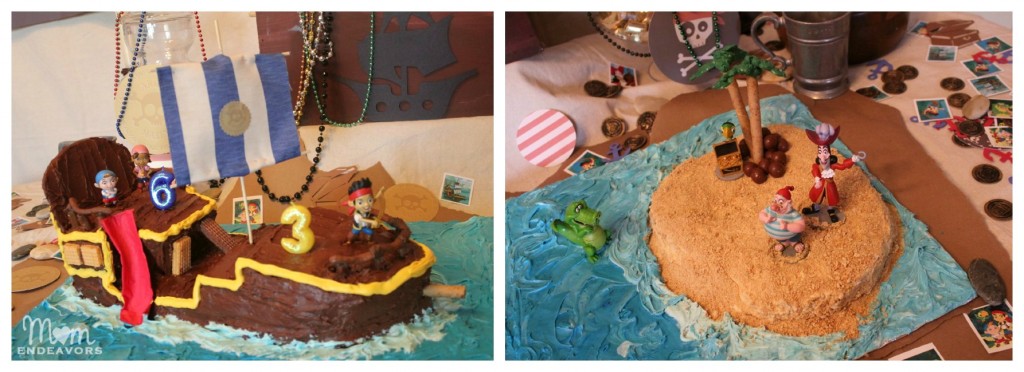
The width and height of the screenshot is (1024, 372). In order to click on cup in this screenshot , I will do tap(818, 56).